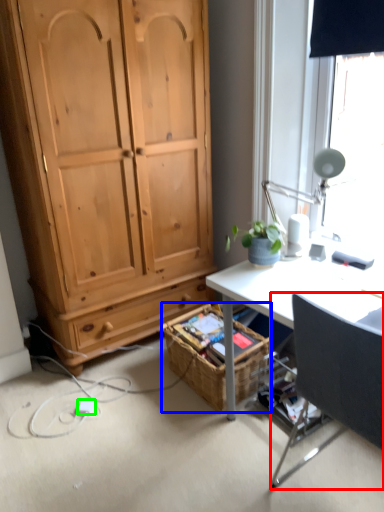
Question: Which object is the farthest from chair (highlighted by a red box)? Choose among these: picnic basket (highlighted by a blue box) or power outlet (highlighted by a green box).

Choices:
 (A) picnic basket
 (B) power outlet

Answer: (B)